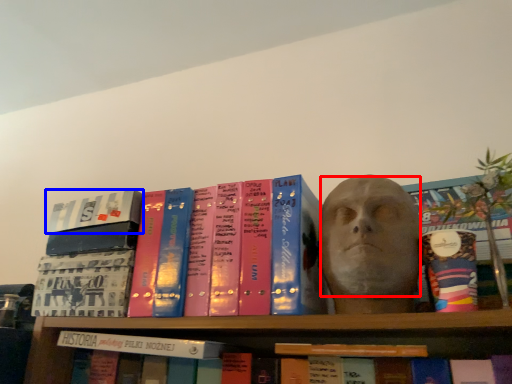
Question: Which of the following is the farthest to the observer, human face (highlighted by a red box) or book (highlighted by a blue box)?

Choices:
 (A) human face
 (B) book

Answer: (B)